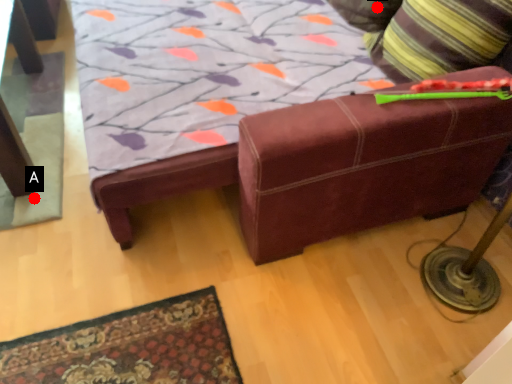
Question: Two points are circled on the image, labeled by A and B beside each circle. Which point appears closest to the camera in this image?

Choices:
 (A) A is closer
 (B) B is closer

Answer: (A)